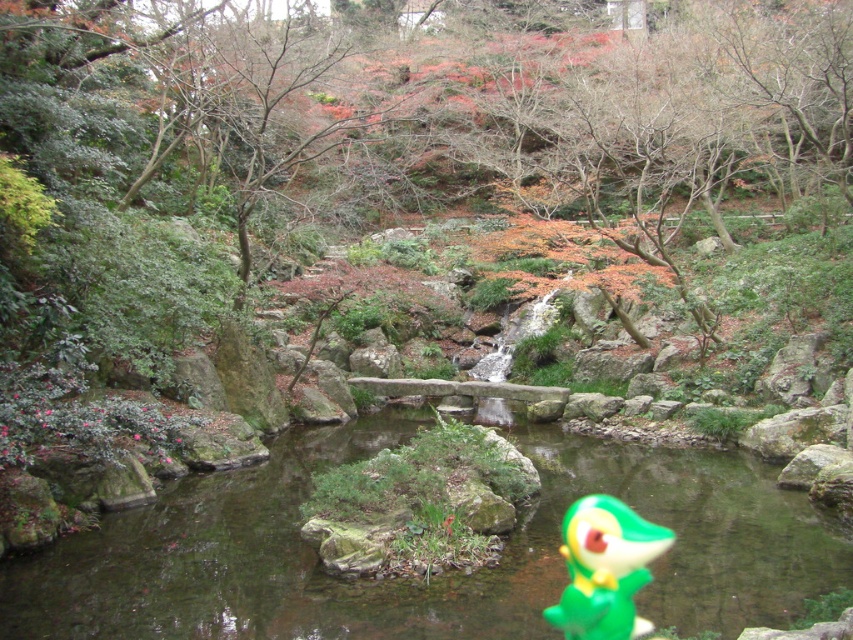
Question: Observing the image, what is the correct spatial positioning of transparent plastic stream at center in reference to green matte toy at center?

Choices:
 (A) right
 (B) left

Answer: (B)

Question: Can you confirm if transparent plastic stream at center is positioned above green matte toy at center?

Choices:
 (A) no
 (B) yes

Answer: (B)

Question: Is transparent plastic stream at center smaller than green matte toy at center?

Choices:
 (A) yes
 (B) no

Answer: (B)

Question: Among these points, which one is farthest from the camera?

Choices:
 (A) (32, 595)
 (B) (616, 513)

Answer: (B)